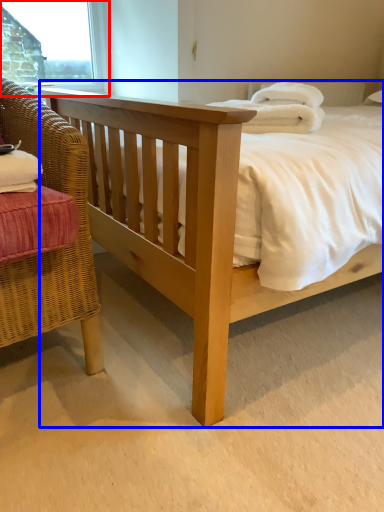
Question: Which point is further to the camera, window frame (highlighted by a red box) or bed (highlighted by a blue box)?

Choices:
 (A) window frame
 (B) bed

Answer: (A)